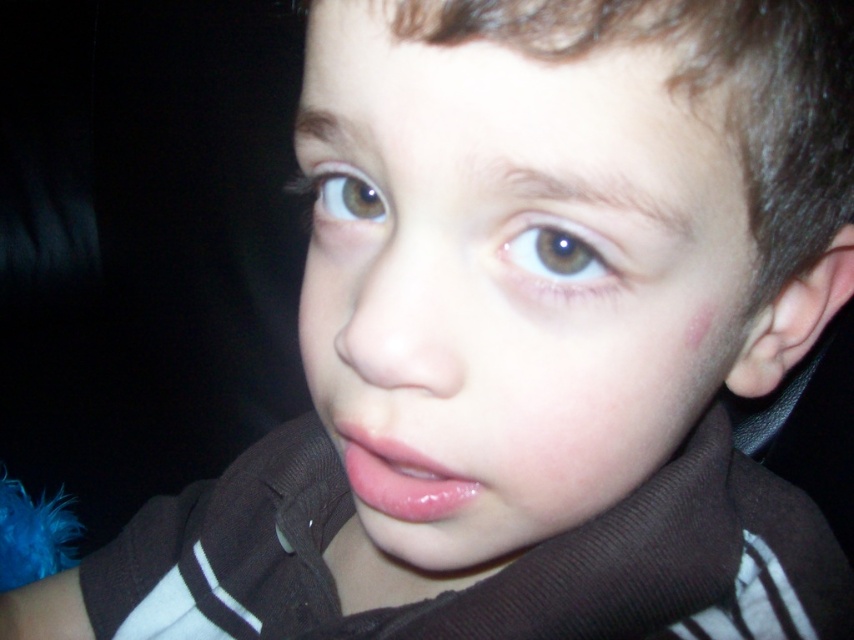
Question: Estimate the real-world distances between objects in this image. Which object is closer to the glossy pink lips at center?

Choices:
 (A) brown glossy eye at upper center
 (B) brown matte eye at upper left
 (C) smooth skin face at center

Answer: (C)

Question: Can you confirm if brown glossy eye at upper center is wider than brown matte eye at upper left?

Choices:
 (A) yes
 (B) no

Answer: (A)

Question: Does brown glossy eye at upper center have a greater width compared to brown matte eye at upper left?

Choices:
 (A) yes
 (B) no

Answer: (A)

Question: Is smooth skin face at center to the left of brown matte eye at upper left from the viewer's perspective?

Choices:
 (A) no
 (B) yes

Answer: (A)

Question: Which object is the farthest from the brown glossy eye at upper center?

Choices:
 (A) smooth skin face at center
 (B) brown matte eye at upper left
 (C) glossy pink lips at center

Answer: (C)

Question: Which point is farther to the camera?

Choices:
 (A) (342, 168)
 (B) (578, 253)
 (C) (702, 400)

Answer: (C)